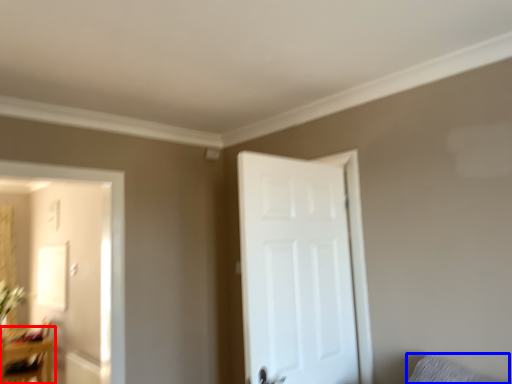
Question: Among these objects, which one is nearest to the camera, table (highlighted by a red box) or pillow (highlighted by a blue box)?

Choices:
 (A) table
 (B) pillow

Answer: (B)